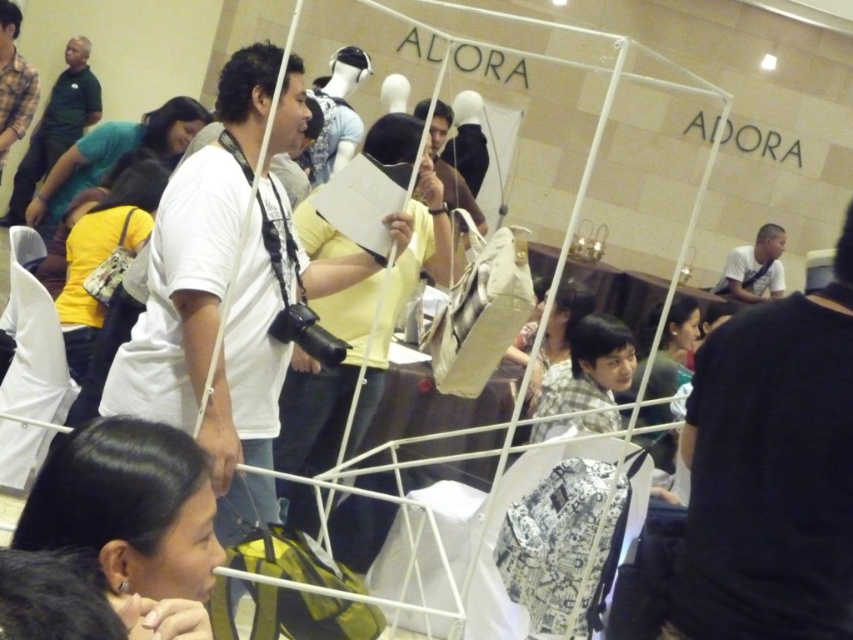
Who is positioned more to the left, black hair at lower left or white shirt at center?

black hair at lower left

From the picture: Does black hair at lower left have a greater width compared to white shirt at center?

No.

Find the location of a particular element. black hair at lower left is located at coordinates (x=131, y=518).